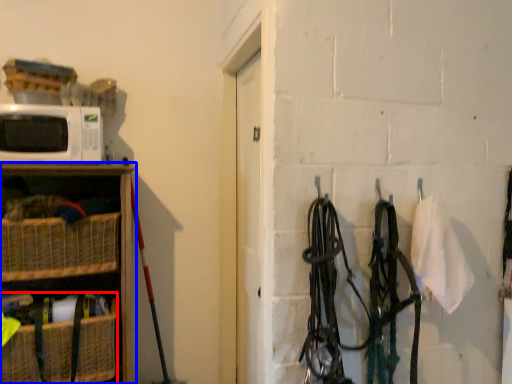
Question: Which object appears farthest to the camera in this image, basket (highlighted by a red box) or shelf (highlighted by a blue box)?

Choices:
 (A) basket
 (B) shelf

Answer: (A)